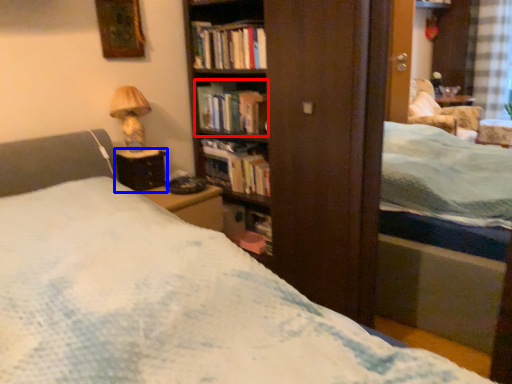
Question: Which object appears farthest to the camera in this image, book (highlighted by a red box) or table (highlighted by a blue box)?

Choices:
 (A) book
 (B) table

Answer: (A)